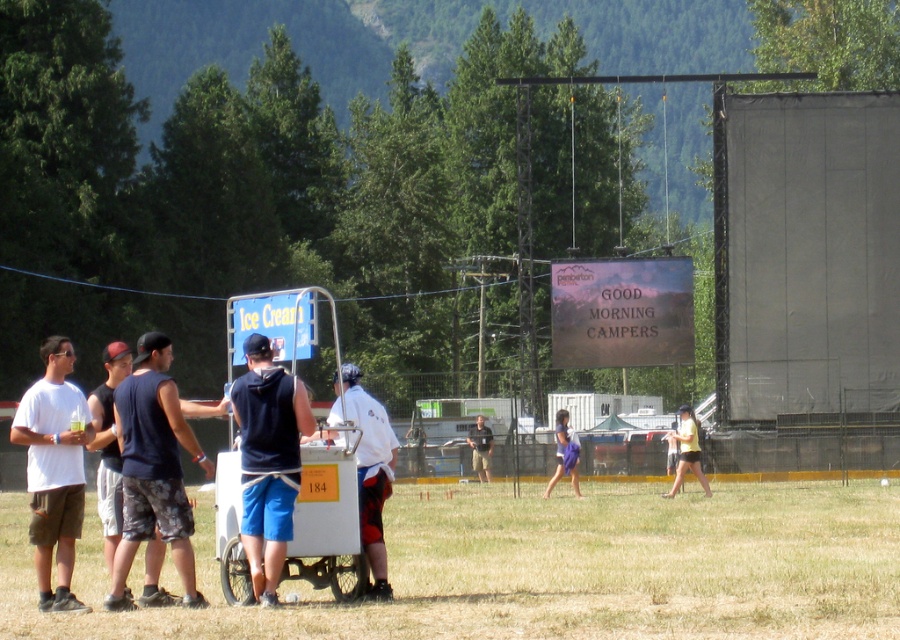
At what (x,y) coordinates should I click in order to perform the action: click on white matte shirt at center. Please return your answer as a coordinate pair (x, y). This screenshot has height=640, width=900. Looking at the image, I should click on (x=369, y=468).

Which is more to the left, white matte shirt at center or yellow cotton shirt at center?

Positioned to the left is white matte shirt at center.

I want to click on white matte shirt at center, so click(x=369, y=468).

Who is taller, white plastic cart at lower center or dark blue fabric hoodie at center?

With more height is white plastic cart at lower center.

Who is more forward, (855, 548) or (246, 362)?

Point (246, 362) is in front.

Locate an element on the screen. The width and height of the screenshot is (900, 640). white plastic cart at lower center is located at coordinates (545, 568).

Is white plastic cart at lower center to the right of dark blue fabric shorts at left from the viewer's perspective?

Indeed, white plastic cart at lower center is positioned on the right side of dark blue fabric shorts at left.

Is white plastic cart at lower center positioned in front of dark blue fabric shorts at left?

Yes.

Which is in front, point (562, 520) or point (145, 512)?

Point (145, 512)

Where is `white plastic cart at lower center`? The width and height of the screenshot is (900, 640). white plastic cart at lower center is located at coordinates (545, 568).